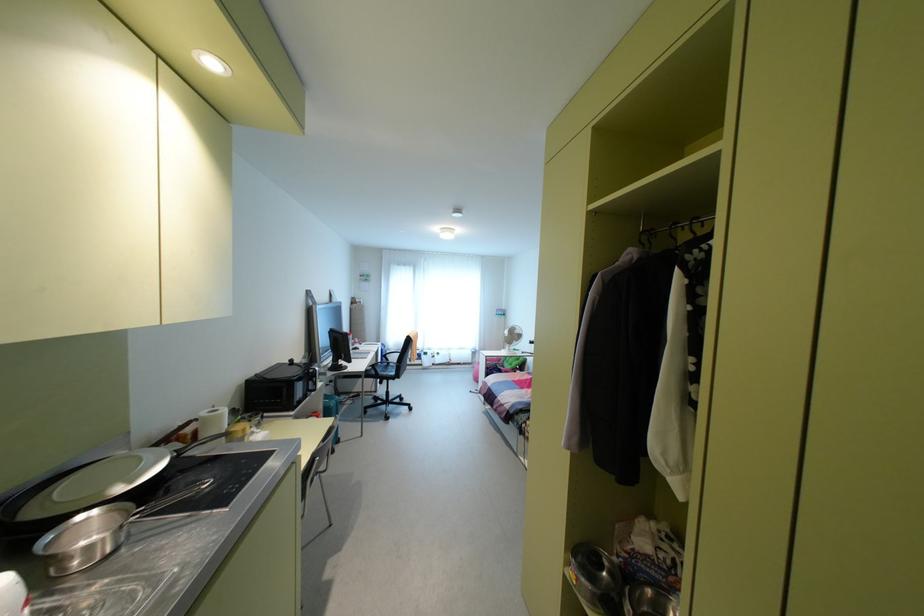
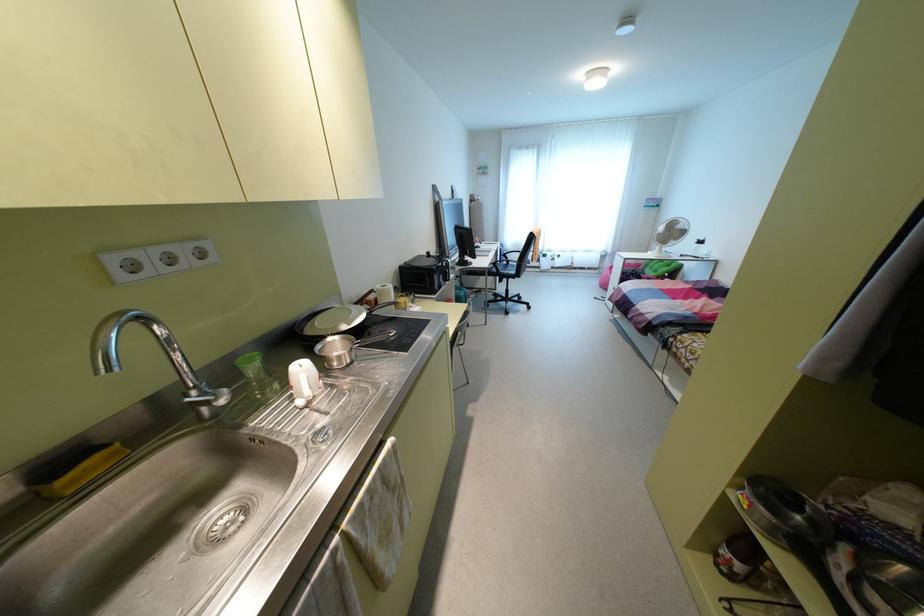
In the second image, find the point that corresponds to [392,373] in the first image.

(513, 272)